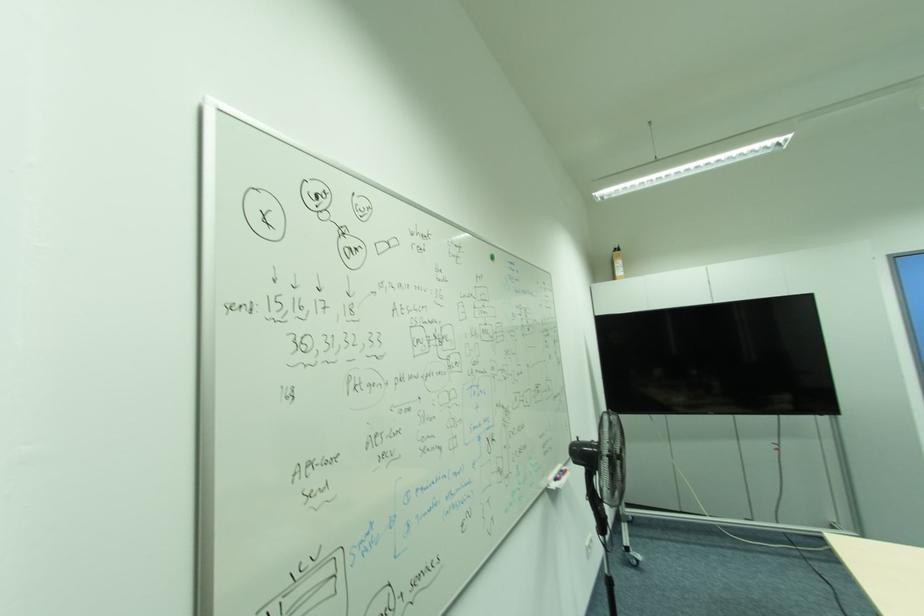
In order to click on bottle pump top in this screenshot , I will do `click(616, 262)`.